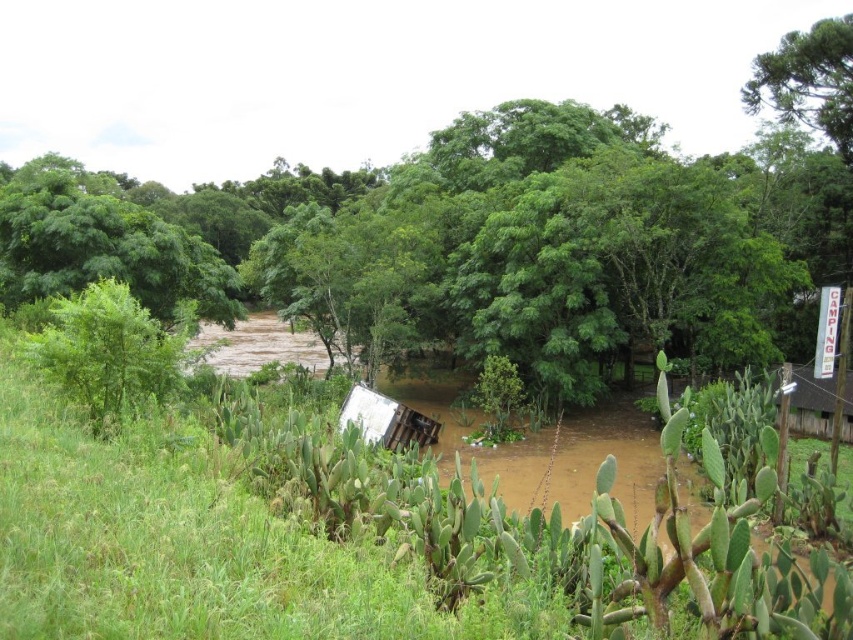
Does green leafy tree at left appear on the left side of green leafy tree at upper right?

Indeed, green leafy tree at left is positioned on the left side of green leafy tree at upper right.

Measure the distance from green leafy tree at left to green leafy tree at upper right.

green leafy tree at left is 127.63 feet from green leafy tree at upper right.

In the scene shown: Who is more distant from viewer, (137, 352) or (796, 68)?

Positioned behind is point (796, 68).

Find the location of a particular element. green leafy tree at left is located at coordinates (107, 353).